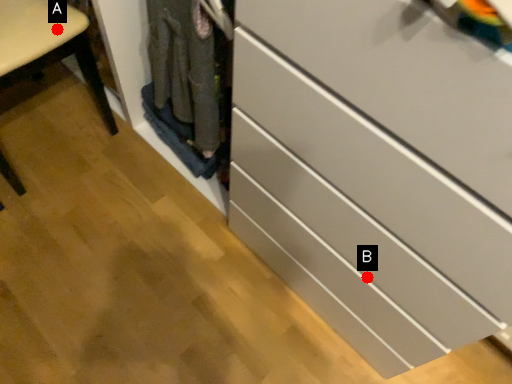
Question: Two points are circled on the image, labeled by A and B beside each circle. Which point is closer to the camera taking this photo?

Choices:
 (A) A is closer
 (B) B is closer

Answer: (B)